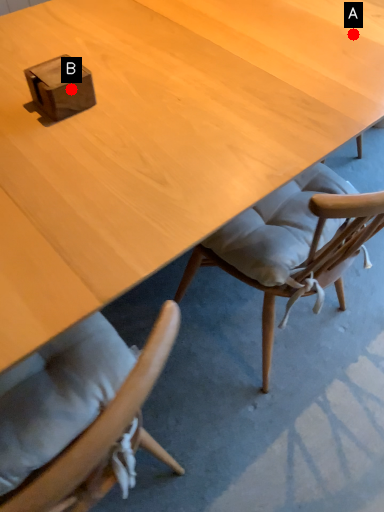
Question: Two points are circled on the image, labeled by A and B beside each circle. Which point is further to the camera?

Choices:
 (A) A is further
 (B) B is further

Answer: (A)